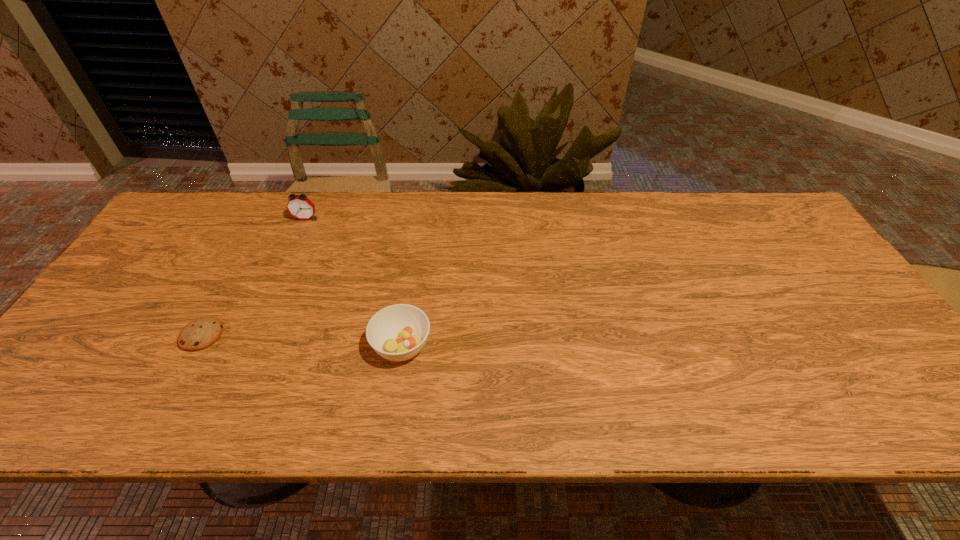
Image resolution: width=960 pixels, height=540 pixels. I want to click on free spot that satisfies the following two spatial constraints: 1. on the clock face of the farthest object; 2. on the left side of the soup bowl, so click(250, 346).

In order to click on free space in the image that satisfies the following two spatial constraints: 1. on the clock face of the second tallest object; 2. on the left side of the tallest object in this screenshot , I will do `click(250, 346)`.

Where is `free space that satisfies the following two spatial constraints: 1. on the front side of the rightmost object; 2. on the right side of the shortest object`? free space that satisfies the following two spatial constraints: 1. on the front side of the rightmost object; 2. on the right side of the shortest object is located at coordinates (196, 346).